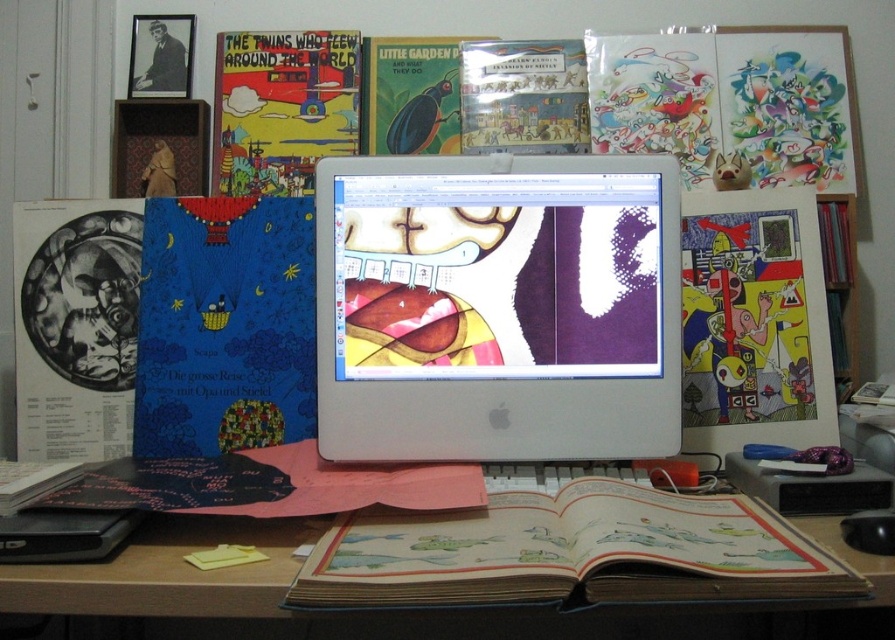
Question: Does yellow paper comic book at center right appear over matte paper comic book at upper left?

Choices:
 (A) yes
 (B) no

Answer: (B)

Question: Which point appears closest to the camera in this image?

Choices:
 (A) pyautogui.click(x=833, y=403)
 (B) pyautogui.click(x=100, y=595)
 (C) pyautogui.click(x=252, y=116)

Answer: (B)

Question: Which point is closer to the camera taking this photo?

Choices:
 (A) (305, 321)
 (B) (433, 195)

Answer: (B)

Question: Considering the real-world distances, which object is farthest from the blue matte book at left?

Choices:
 (A) wooden desk at center
 (B) silver metallic monitor at center
 (C) yellow paper comic book at center right
 (D) matte black book at left

Answer: (C)

Question: Does blue matte book at left appear on the left side of wooden desk at center?

Choices:
 (A) yes
 (B) no

Answer: (A)

Question: Is wooden desk at center below matte black book at left?

Choices:
 (A) no
 (B) yes

Answer: (B)